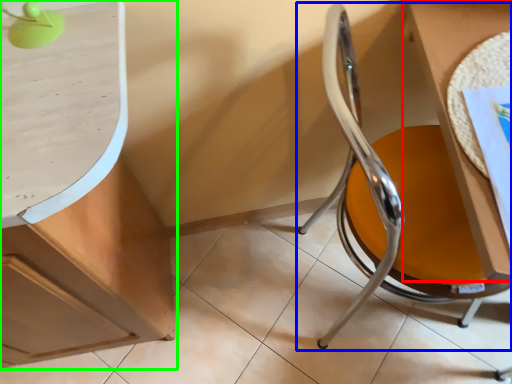
Question: Which is nearer to the table (highlighted by a red box)? chair (highlighted by a blue box) or cabinetry (highlighted by a green box).

Choices:
 (A) chair
 (B) cabinetry

Answer: (A)